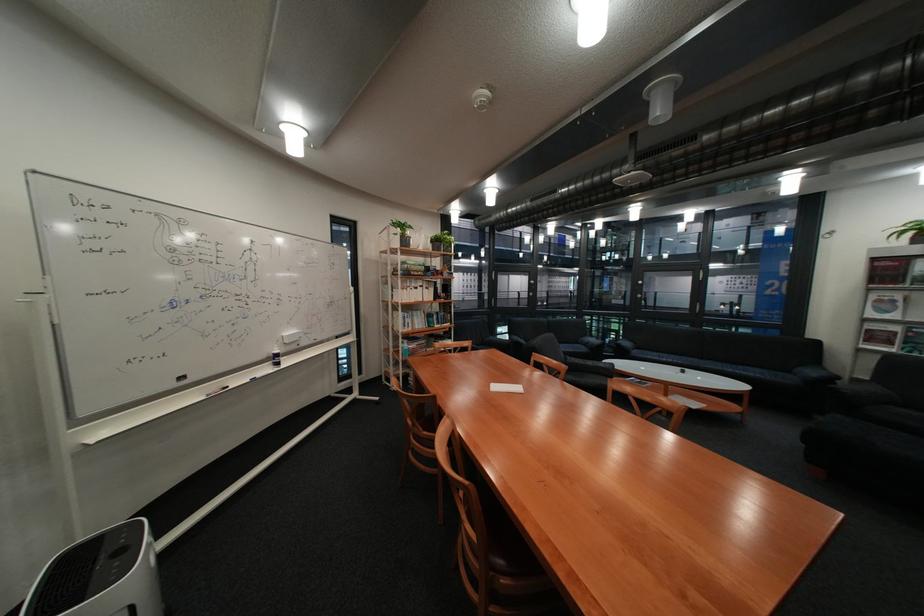
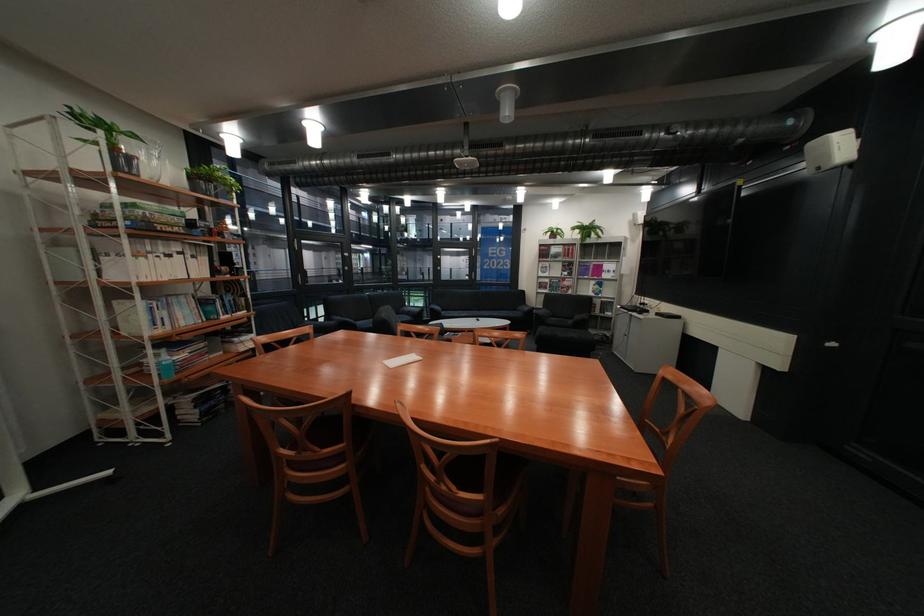
Locate, in the second image, the point that corresponds to (x=805, y=371) in the first image.

(531, 310)